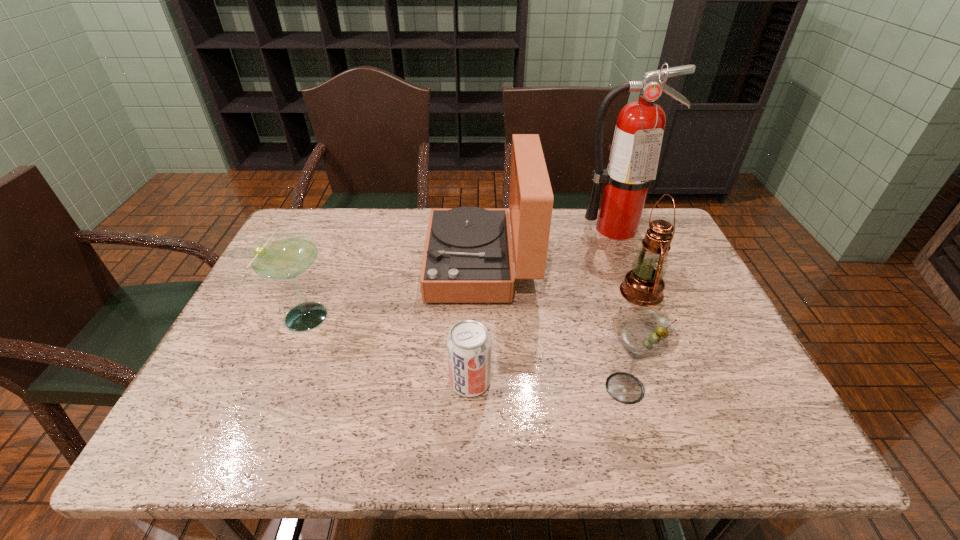
You are a GUI agent. You are given a task and a screenshot of the screen. Output one action in this format:
    pyautogui.click(x=<x>, y=<y>)
    Task: Click on the free space between the phonograph record and the leftmost object
    
    Given the screenshot: What is the action you would take?
    pyautogui.click(x=395, y=289)

Image resolution: width=960 pixels, height=540 pixels. I want to click on free point between the nearer martini and the shortest object, so click(x=548, y=385).

Identify which object is located as the third nearest to the phonograph record. Please provide its 2D coordinates. Your answer should be formatted as a tuple, i.e. [(x, y)], where the tuple contains the x and y coordinates of a point satisfying the conditions above.

[(643, 333)]

Identify the location of object identified as the second closest to the farther martini. (468, 344).

The height and width of the screenshot is (540, 960). What are the coordinates of `free spot that satisfies the following two spatial constraints: 1. on the face of the phonograph record; 2. on the front side of the soda can` in the screenshot? It's located at (481, 382).

Locate an element on the screen. blank area in the image that satisfies the following two spatial constraints: 1. on the front side of the right martini; 2. on the left side of the soda can is located at coordinates tap(469, 388).

Where is `free space that satisfies the following two spatial constraints: 1. on the face of the phonograph record; 2. on the right side of the right martini`? This screenshot has width=960, height=540. free space that satisfies the following two spatial constraints: 1. on the face of the phonograph record; 2. on the right side of the right martini is located at coordinates (481, 388).

Locate an element on the screen. This screenshot has height=540, width=960. vacant region that satisfies the following two spatial constraints: 1. on the face of the nearer martini; 2. on the left side of the phonograph record is located at coordinates (481, 388).

Locate an element on the screen. The image size is (960, 540). free location that satisfies the following two spatial constraints: 1. on the face of the nearer martini; 2. on the left side of the phonograph record is located at coordinates (481, 388).

Image resolution: width=960 pixels, height=540 pixels. I want to click on free space in the image that satisfies the following two spatial constraints: 1. on the face of the phonograph record; 2. on the right side of the nearer martini, so [481, 388].